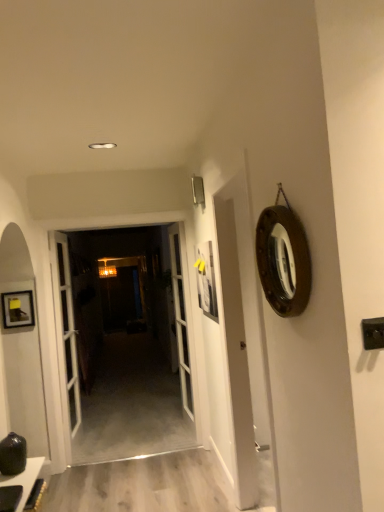
I want to click on vacant point above matte black table at lower left (from a real-world perspective), so (14, 477).